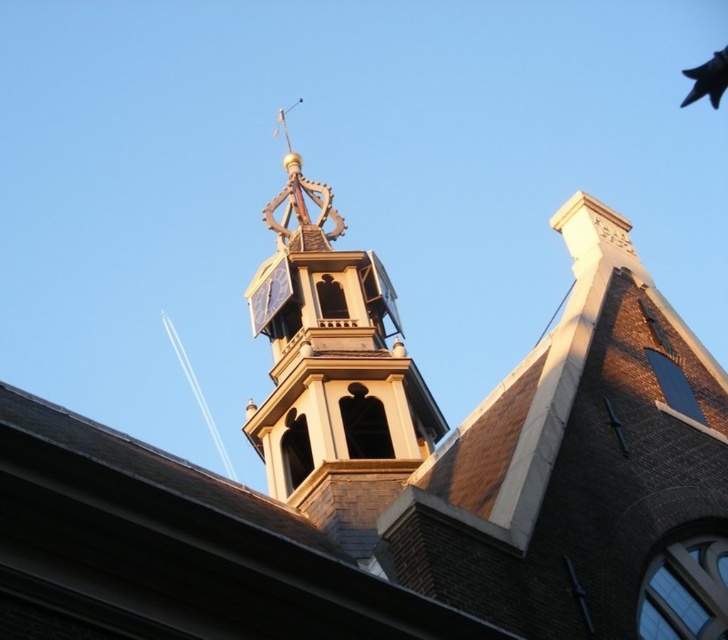
Question: Observing the image, what is the correct spatial positioning of golden brick bell tower at upper center in reference to black feathered pigeon at upper right?

Choices:
 (A) left
 (B) right

Answer: (A)

Question: Which point is closer to the camera?

Choices:
 (A) (364, 456)
 (B) (713, 60)

Answer: (A)

Question: Is golden brick bell tower at upper center to the left of black feathered pigeon at upper right from the viewer's perspective?

Choices:
 (A) no
 (B) yes

Answer: (B)

Question: Is golden brick bell tower at upper center bigger than black feathered pigeon at upper right?

Choices:
 (A) no
 (B) yes

Answer: (A)